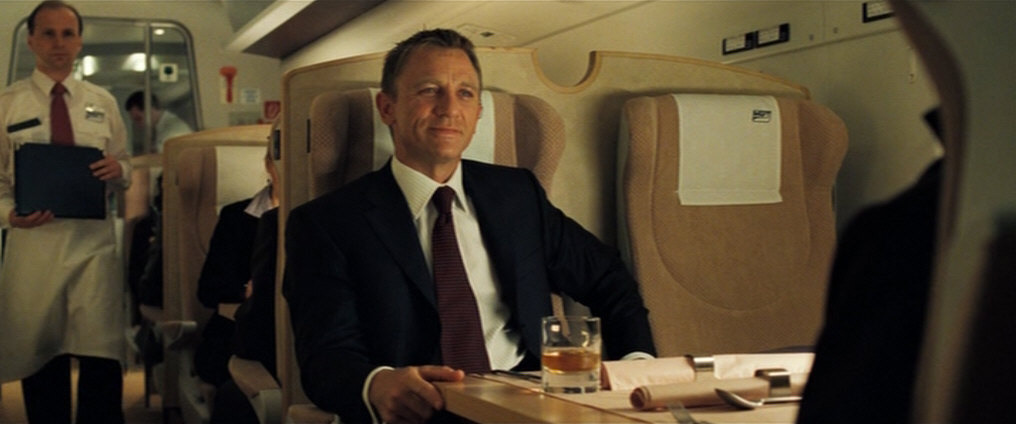
Locate an element on the screen. Image resolution: width=1016 pixels, height=424 pixels. the armrest is located at coordinates (251, 383), (171, 326), (152, 319).